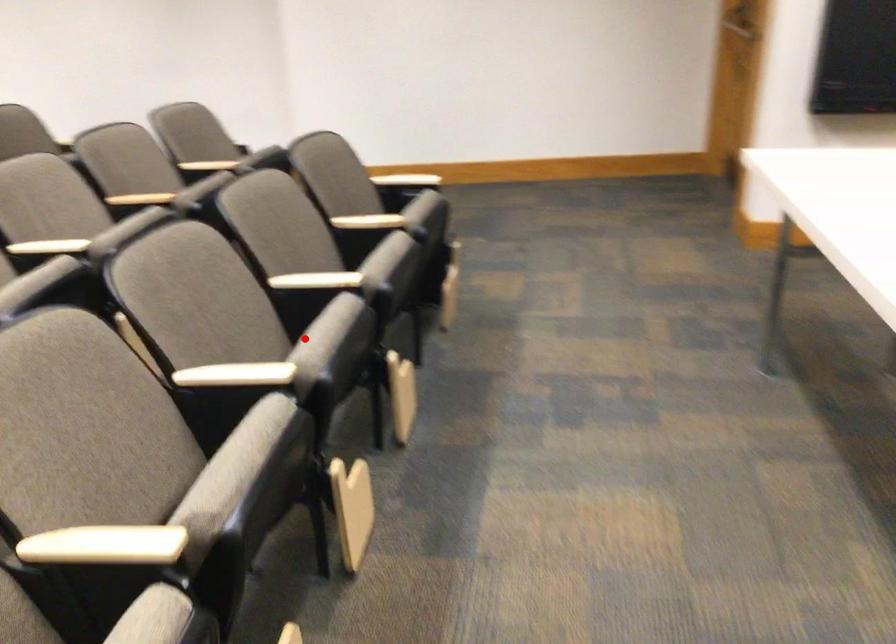
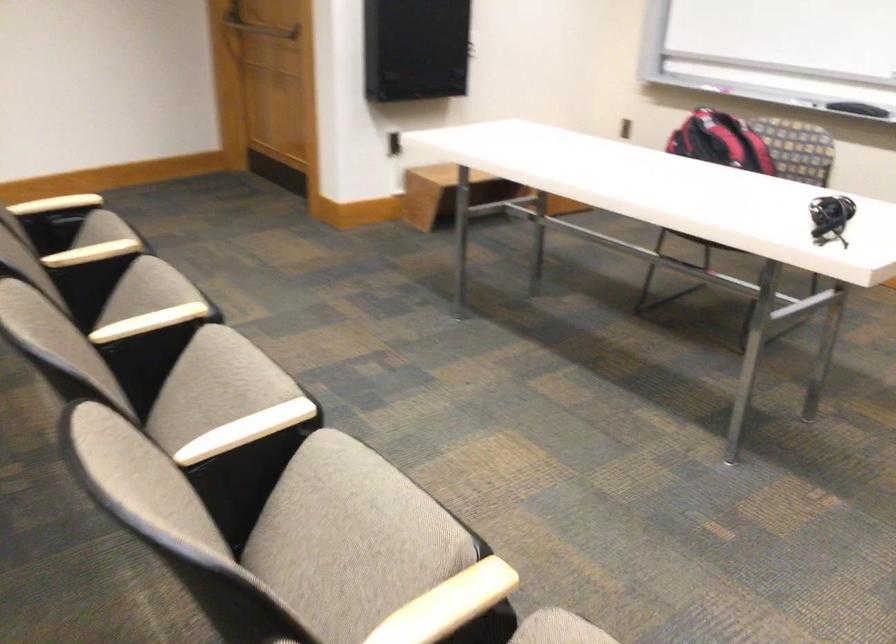
Find the pixel in the second image that matches the highlighted location in the first image.

(214, 386)